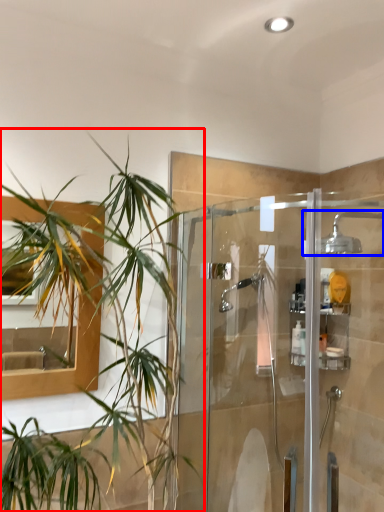
Question: Which object appears closest to the camera in this image, houseplant (highlighted by a red box) or shower (highlighted by a blue box)?

Choices:
 (A) houseplant
 (B) shower

Answer: (A)